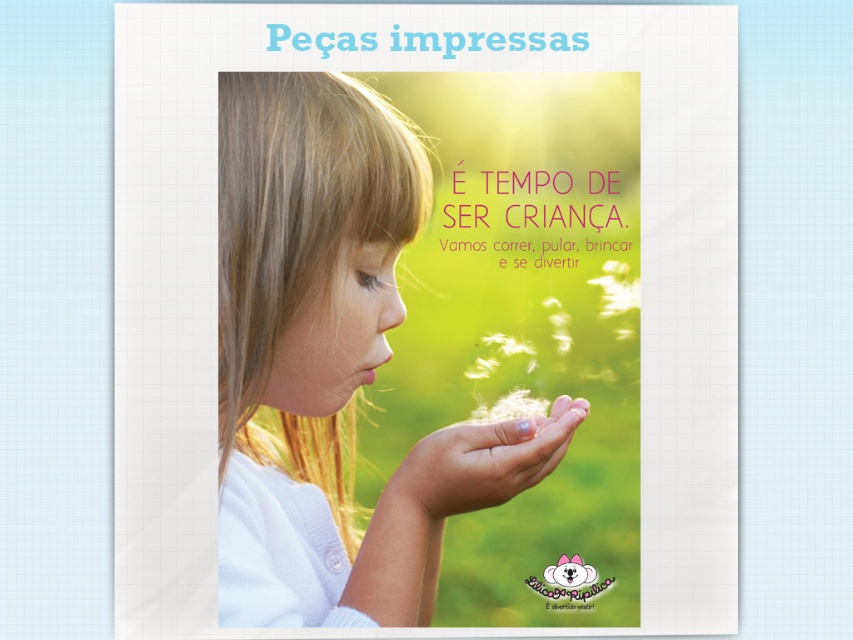
Between point (288, 132) and point (461, 486), which one is positioned behind?

The point (288, 132) is behind.

Is smooth blonde hair at center to the right of pale skin/soft hand at center from the viewer's perspective?

No, smooth blonde hair at center is not to the right of pale skin/soft hand at center.

Which is behind, point (227, 625) or point (509, 442)?

Point (227, 625)

Find the location of a particular element. The image size is (853, 640). smooth blonde hair at center is located at coordinates (332, 360).